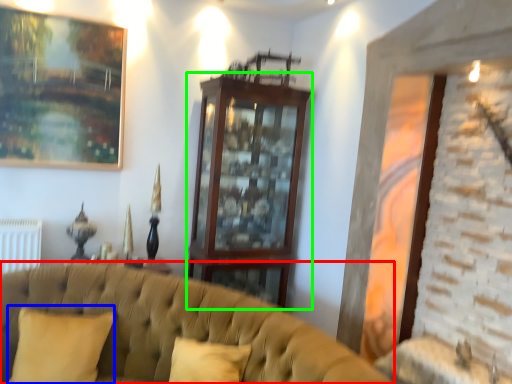
Question: Which object is the farthest from studio couch (highlighted by a red box)? Choose among these: pillow (highlighted by a blue box) or dresser (highlighted by a green box).

Choices:
 (A) pillow
 (B) dresser

Answer: (B)